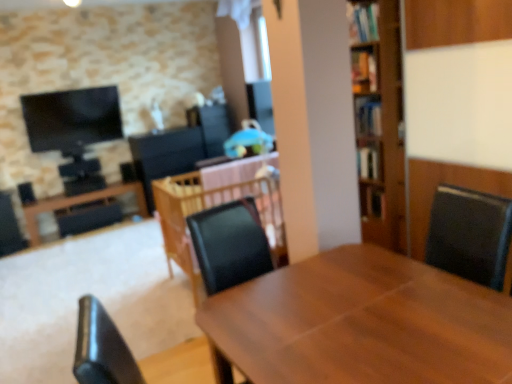
Question: From a real-world perspective, is wooden bookshelf at right, placed as the second shelf when sorted from front to back, physically below wooden table at center, marked as the 3th table in a back-to-front arrangement?

Choices:
 (A) yes
 (B) no

Answer: (B)

Question: Is wooden bookshelf at right, placed as the second shelf when sorted from front to back, surrounding wooden table at center, marked as the 3th table in a back-to-front arrangement?

Choices:
 (A) no
 (B) yes

Answer: (A)

Question: Is wooden bookshelf at right, which is the first shelf from back to front, outside wooden table at center, the third table when ordered from left to right?

Choices:
 (A) no
 (B) yes

Answer: (B)

Question: Is wooden bookshelf at right, the 1th shelf in the bottom-to-top sequence, in front of wooden table at center, marked as the 3th table in a back-to-front arrangement?

Choices:
 (A) no
 (B) yes

Answer: (A)

Question: Does wooden bookshelf at right, which ranks as the second shelf in left-to-right order, have a larger size compared to wooden table at center, the third table when ordered from left to right?

Choices:
 (A) yes
 (B) no

Answer: (B)

Question: Considering the positions of wooden bookshelf at upper right, marked as the second shelf in a right-to-left arrangement, and wooden table at left, the first table viewed from the back, in the image, is wooden bookshelf at upper right, marked as the second shelf in a right-to-left arrangement, taller or shorter than wooden table at left, the first table viewed from the back,?

Choices:
 (A) short
 (B) tall

Answer: (A)

Question: Is wooden bookshelf at upper right, the 1th shelf positioned from the left, in front of or behind wooden table at left, which ranks as the 1th table in left-to-right order, in the image?

Choices:
 (A) front
 (B) behind

Answer: (A)

Question: From a real-world perspective, is wooden bookshelf at upper right, which is the 1th shelf in front-to-back order, physically located above or below wooden table at left, which ranks as the 1th table in left-to-right order?

Choices:
 (A) above
 (B) below

Answer: (A)

Question: Is wooden bookshelf at upper right, which is the 1th shelf in front-to-back order, wider or thinner than wooden table at left, which ranks as the 1th table in left-to-right order?

Choices:
 (A) thin
 (B) wide

Answer: (A)

Question: Considering the positions of wooden bookshelf at right, positioned as the second shelf in top-to-bottom order, and wooden table at left, the first table viewed from the back, in the image, is wooden bookshelf at right, positioned as the second shelf in top-to-bottom order, bigger or smaller than wooden table at left, the first table viewed from the back,?

Choices:
 (A) small
 (B) big

Answer: (A)

Question: From the image's perspective, is wooden bookshelf at right, which is the 1th shelf in right-to-left order, located above or below wooden table at left, which ranks as the third table in right-to-left order?

Choices:
 (A) above
 (B) below

Answer: (A)

Question: Does point pyautogui.click(x=364, y=188) appear closer or farther from the camera than point pyautogui.click(x=133, y=190)?

Choices:
 (A) closer
 (B) farther

Answer: (A)

Question: Is wooden bookshelf at right, positioned as the second shelf in top-to-bottom order, taller or shorter than wooden table at left, which ranks as the third table in right-to-left order?

Choices:
 (A) short
 (B) tall

Answer: (A)

Question: Is wooden table at center, the first table viewed from the front, wider or thinner than wooden table at center, which is counted as the 2th table, starting from the right?

Choices:
 (A) thin
 (B) wide

Answer: (A)

Question: Is point (242, 365) closer or farther from the camera than point (272, 195)?

Choices:
 (A) farther
 (B) closer

Answer: (B)